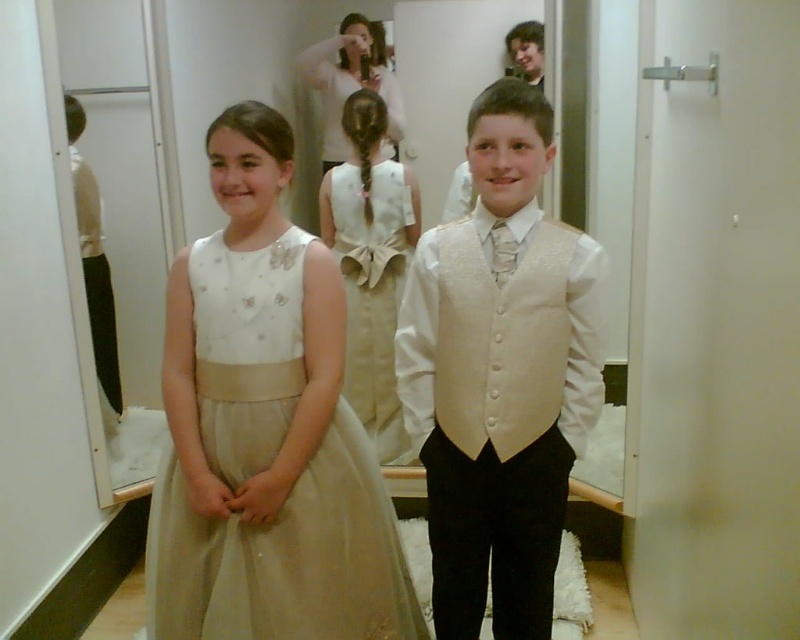
Question: Which of the following is the closest to the observer?

Choices:
 (A) (334, 182)
 (B) (480, 113)
 (C) (338, 508)

Answer: (B)

Question: Which object is the closest to the matte white tulle dress at center?

Choices:
 (A) ivory satin dress at center
 (B) satin white vest at center

Answer: (B)

Question: Is satin white vest at center positioned in front of matte white tulle dress at center?

Choices:
 (A) yes
 (B) no

Answer: (A)

Question: Which point is closer to the camera?

Choices:
 (A) satin white vest at center
 (B) matte white tulle dress at center
 (C) ivory satin dress at center

Answer: (A)

Question: Can you confirm if satin white vest at center is thinner than ivory satin dress at center?

Choices:
 (A) yes
 (B) no

Answer: (B)

Question: Is satin white vest at center smaller than ivory satin dress at center?

Choices:
 (A) no
 (B) yes

Answer: (A)